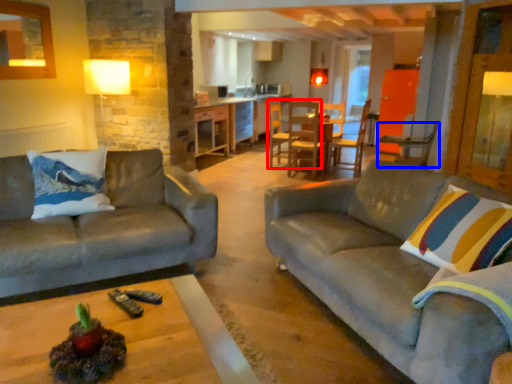
Question: Which object is closer to the camera taking this photo, chair (highlighted by a red box) or chair (highlighted by a blue box)?

Choices:
 (A) chair
 (B) chair

Answer: (B)